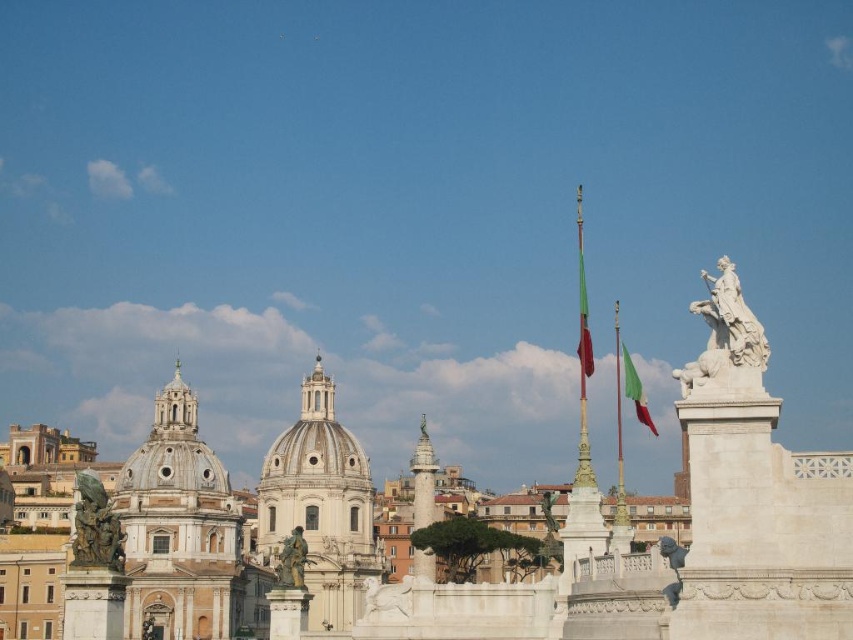
Describe the element at coordinates (271, 550) in the screenshot. The image size is (853, 640). I see `white marble statue at center` at that location.

This screenshot has width=853, height=640. I want to click on white marble statue at center, so click(271, 550).

Find the location of a particular element. The width and height of the screenshot is (853, 640). white marble statue at upper right is located at coordinates (724, 330).

Between point (703, 276) and point (115, 564), which one is positioned in front?

Point (115, 564)

Is point (709, 372) more distant than point (100, 547)?

No.

I want to click on white marble statue at upper right, so click(724, 330).

Is bronze statue at left to the right of green fabric flag at center from the viewer's perspective?

In fact, bronze statue at left is to the left of green fabric flag at center.

At what (x,y) coordinates should I click in order to perform the action: click on bronze statue at left. Please return your answer as a coordinate pair (x, y). This screenshot has height=640, width=853. Looking at the image, I should click on (96, 528).